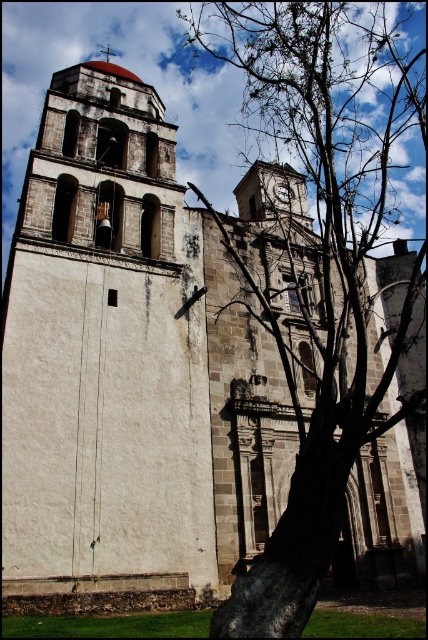
Question: Is white stone bell tower at center to the right of brown bark tree at center from the viewer's perspective?

Choices:
 (A) yes
 (B) no

Answer: (B)

Question: Which object appears farthest from the camera in this image?

Choices:
 (A) brown bark tree at center
 (B) white stone bell tower at center
 (C) metallic clock at center

Answer: (C)

Question: Among these objects, which one is farthest from the camera?

Choices:
 (A) brown bark tree at center
 (B) white stone bell tower at center

Answer: (B)

Question: Which is nearer to the metallic clock at center?

Choices:
 (A) brown bark tree at center
 (B) white stone bell tower at center

Answer: (B)

Question: Is white stone bell tower at center bigger than brown bark tree at center?

Choices:
 (A) no
 (B) yes

Answer: (A)

Question: Is brown bark tree at center below metallic clock at center?

Choices:
 (A) yes
 (B) no

Answer: (B)